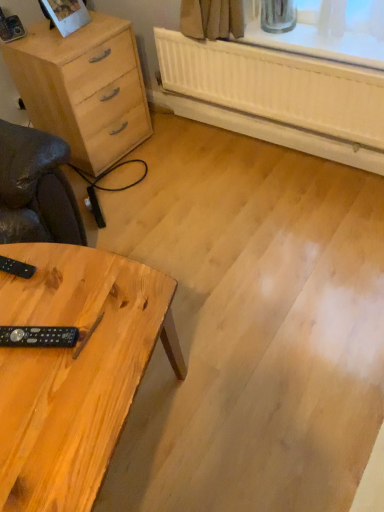
How much space does black plastic remote at lower left, marked as the 2th control in a front-to-back arrangement, occupy horizontally?

It is 5.94 inches.

Locate an element on the screen. This screenshot has width=384, height=512. natural wood table at lower left is located at coordinates (75, 370).

Describe the element at coordinates (84, 88) in the screenshot. This screenshot has width=384, height=512. I see `natural wood chest of drawers at left` at that location.

The image size is (384, 512). Find the location of `black plastic remote at lower left, which is the 2th control from bottom to top`. black plastic remote at lower left, which is the 2th control from bottom to top is located at coordinates (16, 268).

From a real-world perspective, between black plastic remote at lower left, the second control in the back-to-front sequence, and natural wood table at lower left, who is vertically higher?

black plastic remote at lower left, the second control in the back-to-front sequence, from a real-world perspective.

At what (x,y) coordinates should I click in order to perform the action: click on table in front of the black plastic remote at lower left, acting as the first control starting from the front. Please return your answer as a coordinate pair (x, y). Looking at the image, I should click on (75, 370).

Considering the relative sizes of black plastic remote at lower left, acting as the 1th control starting from the bottom, and natural wood table at lower left in the image provided, is black plastic remote at lower left, acting as the 1th control starting from the bottom, bigger than natural wood table at lower left?

No.

Considering the sizes of natural wood table at lower left and black plastic remote at lower left, acting as the 1th control starting from the top, in the image, is natural wood table at lower left bigger or smaller than black plastic remote at lower left, acting as the 1th control starting from the top,?

In the image, natural wood table at lower left appears to be larger than black plastic remote at lower left, acting as the 1th control starting from the top.

Would you say black plastic remote at lower left, the first control in the back-to-front sequence, is part of natural wood table at lower left's contents?

That's correct, black plastic remote at lower left, the first control in the back-to-front sequence, is inside natural wood table at lower left.

Which of these two, natural wood table at lower left or black plastic remote at lower left, acting as the 1th control starting from the top, is thinner?

black plastic remote at lower left, acting as the 1th control starting from the top.

Which object is closer to the camera, natural wood table at lower left or black plastic remote at lower left, marked as the 2th control in a front-to-back arrangement?

natural wood table at lower left is more forward.

Between point (86, 152) and point (16, 273), which one is positioned in front?

Positioned in front is point (16, 273).

This screenshot has height=512, width=384. In order to click on chest of drawers below the black plastic remote at lower left, marked as the 2th control in a front-to-back arrangement (from a real-world perspective) in this screenshot , I will do `click(84, 88)`.

How distant is natural wood chest of drawers at left from black plastic remote at lower left, marked as the 2th control in a front-to-back arrangement?

They are 3.51 feet apart.

Considering the positions of objects natural wood chest of drawers at left and black plastic remote at lower left, the first control in the back-to-front sequence, in the image provided, who is in front, natural wood chest of drawers at left or black plastic remote at lower left, the first control in the back-to-front sequence,?

black plastic remote at lower left, the first control in the back-to-front sequence, is more forward.

Is black plastic remote at lower left, which is the 2th control from bottom to top, positioned with its back to natural wood chest of drawers at left?

No, black plastic remote at lower left, which is the 2th control from bottom to top,'s orientation is not away from natural wood chest of drawers at left.

Is the depth of black plastic remote at lower left, acting as the 1th control starting from the top, less than that of natural wood chest of drawers at left?

Yes, black plastic remote at lower left, acting as the 1th control starting from the top, is closer to the camera.

Is black plastic remote at lower left, the first control in the back-to-front sequence, placed right next to natural wood chest of drawers at left?

No, black plastic remote at lower left, the first control in the back-to-front sequence, is not with natural wood chest of drawers at left.

Is black plastic remote at lower left, which is the 2th control from bottom to top, surrounding natural wood chest of drawers at left?

Definitely not — natural wood chest of drawers at left is not inside black plastic remote at lower left, which is the 2th control from bottom to top.

Does point (48, 53) appear closer or farther from the camera than point (75, 262)?

Clearly, point (48, 53) is more distant from the camera than point (75, 262).

Is natural wood chest of drawers at left in contact with natural wood table at lower left?

No.

From a real-world perspective, between natural wood chest of drawers at left and natural wood table at lower left, who is vertically lower?

From a 3D spatial view, natural wood table at lower left is below.

Can you confirm if natural wood chest of drawers at left is bigger than natural wood table at lower left?

No, natural wood chest of drawers at left is not bigger than natural wood table at lower left.

From the image's perspective, is black plastic remote at lower left, marked as the 2th control in a front-to-back arrangement, beneath natural wood table at lower left?

No, from the image's perspective, black plastic remote at lower left, marked as the 2th control in a front-to-back arrangement, is not beneath natural wood table at lower left.

Can you confirm if black plastic remote at lower left, the first control in the back-to-front sequence, is smaller than natural wood table at lower left?

Yes.

From the picture: Are black plastic remote at lower left, acting as the 1th control starting from the top, and natural wood table at lower left far apart?

No.

Consider the image. From the image's perspective, which object appears higher, black plastic remote at lower left, acting as the 1th control starting from the top, or black plastic remote at lower left, acting as the first control starting from the front?

black plastic remote at lower left, acting as the 1th control starting from the top, appears higher in the image.

Are black plastic remote at lower left, the first control in the back-to-front sequence, and black plastic remote at lower left, the second control in the back-to-front sequence, far apart?

They are positioned close to each other.

Looking at this image, between black plastic remote at lower left, which is the 2th control from bottom to top, and black plastic remote at lower left, arranged as the 2th control when viewed from the top, which one has smaller width?

Thinner between the two is black plastic remote at lower left, which is the 2th control from bottom to top.

This screenshot has height=512, width=384. I want to click on the 1st control counting from the left of the natural wood table at lower left, so click(x=39, y=336).

The height and width of the screenshot is (512, 384). What are the coordinates of `table that appears in front of the black plastic remote at lower left, marked as the 2th control in a front-to-back arrangement` in the screenshot? It's located at tap(75, 370).

Based on their spatial positions, is black plastic remote at lower left, acting as the first control starting from the front, or black plastic remote at lower left, marked as the 2th control in a front-to-back arrangement, closer to natural wood chest of drawers at left?

black plastic remote at lower left, marked as the 2th control in a front-to-back arrangement, lies closer to natural wood chest of drawers at left than the other object.

Looking at this image, considering their positions, is black plastic remote at lower left, acting as the 1th control starting from the bottom, positioned further to natural wood chest of drawers at left than natural wood table at lower left?

Among the two, black plastic remote at lower left, acting as the 1th control starting from the bottom, is located further to natural wood chest of drawers at left.

When comparing their distances from natural wood chest of drawers at left, does natural wood table at lower left or black plastic remote at lower left, acting as the 1th control starting from the bottom, seem further?

Based on the image, black plastic remote at lower left, acting as the 1th control starting from the bottom, appears to be further to natural wood chest of drawers at left.

When comparing their distances from black plastic remote at lower left, the second control in the back-to-front sequence, does black plastic remote at lower left, acting as the 1th control starting from the top, or natural wood chest of drawers at left seem closer?

The object closer to black plastic remote at lower left, the second control in the back-to-front sequence, is black plastic remote at lower left, acting as the 1th control starting from the top.

From the picture: When comparing their distances from natural wood table at lower left, does natural wood chest of drawers at left or black plastic remote at lower left, the first control in the back-to-front sequence, seem closer?

Based on the image, black plastic remote at lower left, the first control in the back-to-front sequence, appears to be nearer to natural wood table at lower left.

From the image, which object appears to be farther from black plastic remote at lower left, acting as the 1th control starting from the bottom, natural wood chest of drawers at left or natural wood table at lower left?

natural wood chest of drawers at left is further to black plastic remote at lower left, acting as the 1th control starting from the bottom.

When comparing their distances from black plastic remote at lower left, the first control in the back-to-front sequence, does natural wood table at lower left or black plastic remote at lower left, arranged as the 2th control when viewed from the top, seem further?

The object further to black plastic remote at lower left, the first control in the back-to-front sequence, is natural wood table at lower left.

Looking at the image, which one is located closer to black plastic remote at lower left, marked as the 2th control in a front-to-back arrangement, black plastic remote at lower left, acting as the first control starting from the front, or natural wood chest of drawers at left?

Among the two, black plastic remote at lower left, acting as the first control starting from the front, is located nearer to black plastic remote at lower left, marked as the 2th control in a front-to-back arrangement.

I want to click on control between natural wood chest of drawers at left and black plastic remote at lower left, acting as the first control starting from the front, vertically, so click(16, 268).

Where is `control between natural wood table at lower left and black plastic remote at lower left, marked as the 2th control in a front-to-back arrangement, from front to back`? control between natural wood table at lower left and black plastic remote at lower left, marked as the 2th control in a front-to-back arrangement, from front to back is located at coordinates (39, 336).